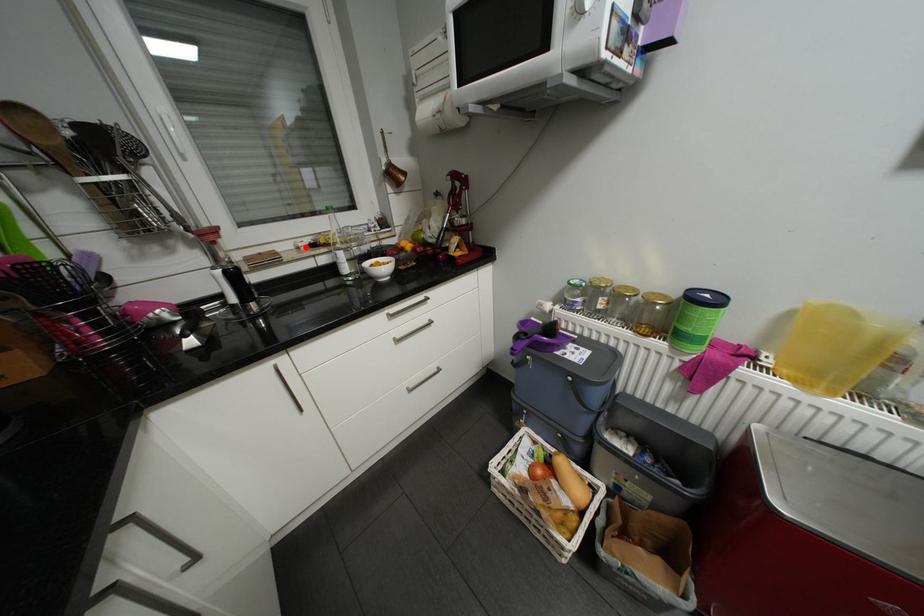
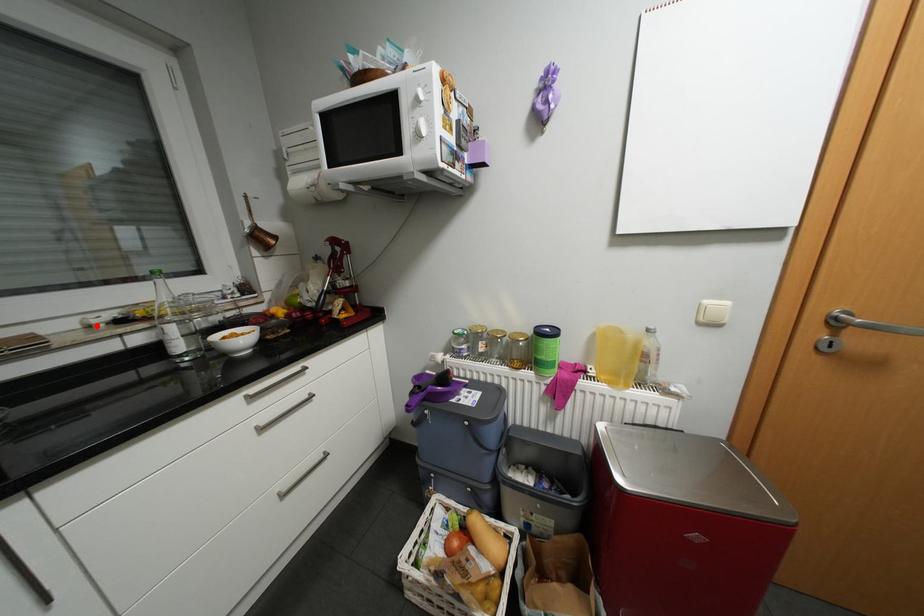
I am providing you with two images of the same scene from different viewpoints. A red point is marked on the first image and another point is marked on the second image. Are the points marked in image1 and image2 representing the same 3D position?

Yes